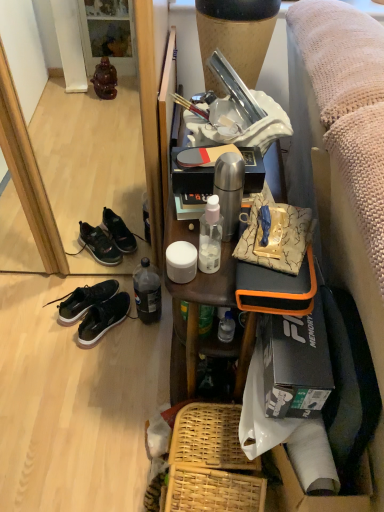
What do you see at coordinates (212, 463) in the screenshot?
I see `woven wood picnic basket at lower center` at bounding box center [212, 463].

Locate an element on the screen. The width and height of the screenshot is (384, 512). black matte sneakers at lower left is located at coordinates (103, 319).

What do you see at coordinates (85, 300) in the screenshot?
I see `black matte sneakers at lower left` at bounding box center [85, 300].

Describe the element at coordinates (28, 174) in the screenshot. I see `matte black mirror at lower left` at that location.

The width and height of the screenshot is (384, 512). I want to click on translucent plastic bottle at lower left, so click(147, 292).

Which is in front, textured beige fabric couch at right or black matte sneakers at lower left?

textured beige fabric couch at right.

Considering the sizes of objects textured beige fabric couch at right and black matte sneakers at lower left in the image provided, who is thinner, textured beige fabric couch at right or black matte sneakers at lower left?

black matte sneakers at lower left is thinner.

From a real-world perspective, between textured beige fabric couch at right and black matte sneakers at lower left, who is vertically higher?

textured beige fabric couch at right.

Find the location of a particular element. This screenshot has width=384, height=512. studio couch that appears in front of the black matte sneakers at lower left is located at coordinates (344, 158).

Looking at this image, would you say wooden table at upper right is inside or outside matte black mirror at lower left?

wooden table at upper right is not inside matte black mirror at lower left, it's outside.

Is wooden table at upper right positioned behind matte black mirror at lower left?

That is False.

From the image's perspective, which is above, wooden table at upper right or matte black mirror at lower left?

From the image's view, matte black mirror at lower left is above.

Considering the sizes of objects wooden table at upper right and matte black mirror at lower left in the image provided, who is smaller, wooden table at upper right or matte black mirror at lower left?

Smaller between the two is wooden table at upper right.

Is black matte sneakers at lower left not close to textured beige fabric couch at right?

Indeed, black matte sneakers at lower left is not near textured beige fabric couch at right.

Does black matte sneakers at lower left appear on the right side of textured beige fabric couch at right?

Incorrect, black matte sneakers at lower left is not on the right side of textured beige fabric couch at right.

Considering the relative sizes of black matte sneakers at lower left and textured beige fabric couch at right in the image provided, is black matte sneakers at lower left smaller than textured beige fabric couch at right?

Correct, black matte sneakers at lower left occupies less space than textured beige fabric couch at right.

Identify the location of studio couch located in front of the black matte sneakers at lower left. (344, 158).

Is wooden table at upper right bigger than black matte sneakers at lower left?

Yes, wooden table at upper right is bigger than black matte sneakers at lower left.

Looking at their sizes, would you say wooden table at upper right is wider or thinner than black matte sneakers at lower left?

Clearly, wooden table at upper right has more width compared to black matte sneakers at lower left.

Looking at this image, is wooden table at upper right further to the viewer compared to black matte sneakers at lower left?

No, wooden table at upper right is closer to the viewer.

Is wooden table at upper right not close to black matte sneakers at lower left?

wooden table at upper right is near black matte sneakers at lower left, not far away.

Can you confirm if woven wood picnic basket at lower center is positioned to the left of black matte sneakers at lower left?

No.

From the image's perspective, relative to black matte sneakers at lower left, is woven wood picnic basket at lower center above or below?

Based on their image positions, woven wood picnic basket at lower center is located beneath black matte sneakers at lower left.

Based on the photo, between woven wood picnic basket at lower center and black matte sneakers at lower left, which one has larger size?

woven wood picnic basket at lower center.

From the image's perspective, which object appears higher, black matte sneakers at lower left or black matte sneakers at lower left?

black matte sneakers at lower left appears higher in the image.

Is black matte sneakers at lower left turned away from black matte sneakers at lower left?

No.

Is point (110, 285) closer to camera compared to point (110, 311)?

No, (110, 285) is further to viewer.

Is black matte sneakers at lower left located within black matte sneakers at lower left?

No, black matte sneakers at lower left is not inside black matte sneakers at lower left.

Is the position of matte black mirror at lower left less distant than that of textured beige fabric couch at right?

That is False.

From a real-world perspective, relative to textured beige fabric couch at right, is matte black mirror at lower left vertically above or below?

Clearly, from a real-world perspective, matte black mirror at lower left is above textured beige fabric couch at right.

Between point (23, 182) and point (372, 318), which one is positioned behind?

Positioned behind is point (23, 182).

How many degrees apart are the facing directions of matte black mirror at lower left and textured beige fabric couch at right?

The angular difference between matte black mirror at lower left and textured beige fabric couch at right is 90 degrees.

Identify the location of studio couch above the black matte sneakers at lower left (from a real-world perspective). (344, 158).

I want to click on furniture that appears below the matte black mirror at lower left (from a real-world perspective), so click(213, 330).

Estimate the real-world distances between objects in this image. Which object is closer to matte black mirror at lower left, translucent plastic bottle at lower left or textured beige fabric couch at right?

The object closer to matte black mirror at lower left is translucent plastic bottle at lower left.

Estimate the real-world distances between objects in this image. Which object is closer to textured beige fabric couch at right, woven wood picnic basket at lower center or black matte sneakers at lower left?

woven wood picnic basket at lower center is closer to textured beige fabric couch at right.

Based on their spatial positions, is wooden table at upper right or translucent plastic bottle at lower left closer to woven wood picnic basket at lower center?

Based on the image, wooden table at upper right appears to be nearer to woven wood picnic basket at lower center.

Which object lies further to the anchor point wooden table at upper right, black matte sneakers at lower left or matte black mirror at lower left?

Among the two, matte black mirror at lower left is located further to wooden table at upper right.

Based on their spatial positions, is black matte sneakers at lower left or woven wood picnic basket at lower center closer to matte black mirror at lower left?

Based on the image, black matte sneakers at lower left appears to be nearer to matte black mirror at lower left.

When comparing their distances from textured beige fabric couch at right, does wooden table at upper right or woven wood picnic basket at lower center seem further?

Among the two, woven wood picnic basket at lower center is located further to textured beige fabric couch at right.

Estimate the real-world distances between objects in this image. Which object is further from translucent plastic bottle at lower left, black matte sneakers at lower left or wooden table at upper right?

wooden table at upper right lies further to translucent plastic bottle at lower left than the other object.

Considering their positions, is textured beige fabric couch at right positioned further to wooden table at upper right than translucent plastic bottle at lower left?

The object further to wooden table at upper right is translucent plastic bottle at lower left.

Image resolution: width=384 pixels, height=512 pixels. Identify the location of furniture positioned between textured beige fabric couch at right and black matte sneakers at lower left from near to far. (213, 330).

At what (x,y) coordinates should I click in order to perform the action: click on sneakers located between matte black mirror at lower left and textured beige fabric couch at right in the left-right direction. Please return your answer as a coordinate pair (x, y). Looking at the image, I should click on (103, 319).

Identify the location of bottle that lies between matte black mirror at lower left and black matte sneakers at lower left from top to bottom. (147, 292).

Find the location of `picnic basket between wooden table at upper right and black matte sneakers at lower left from front to back`. picnic basket between wooden table at upper right and black matte sneakers at lower left from front to back is located at coordinates (212, 463).